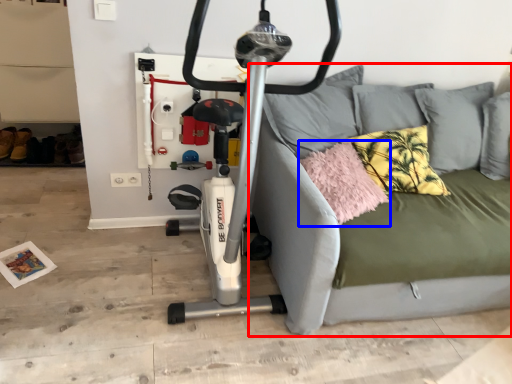
Question: Which object appears farthest to the camera in this image, studio couch (highlighted by a red box) or pillow (highlighted by a blue box)?

Choices:
 (A) studio couch
 (B) pillow

Answer: (B)